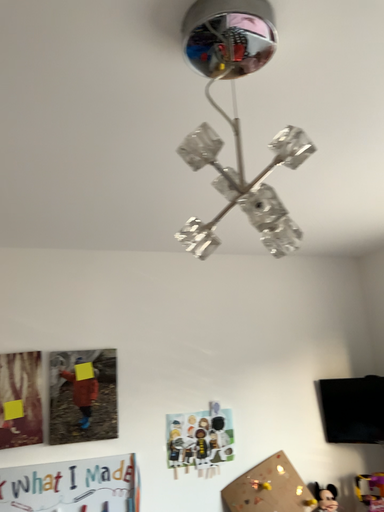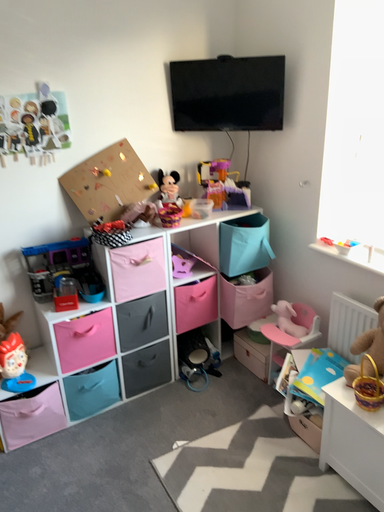
Question: Which way did the camera rotate in the video?

Choices:
 (A) rotated left
 (B) rotated right

Answer: (B)